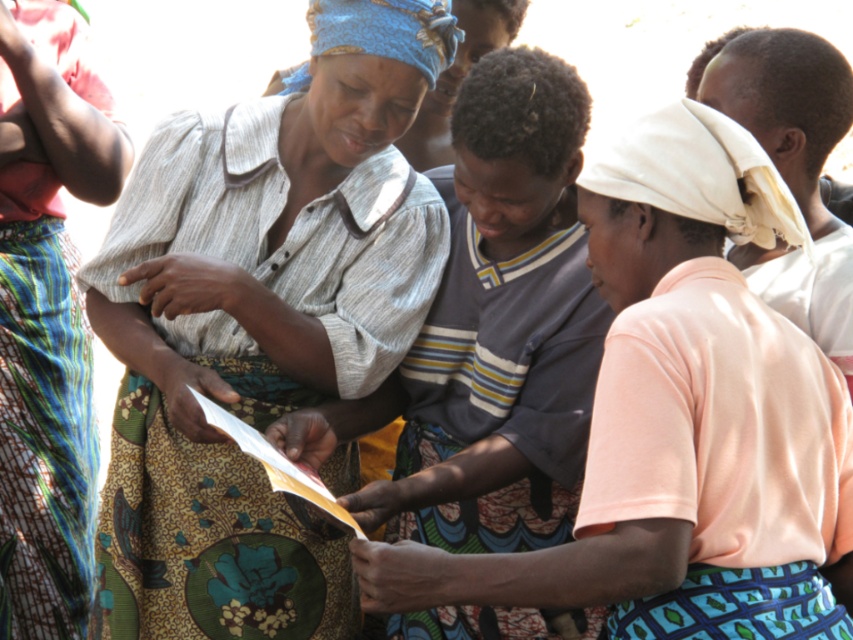
You are standing at the origin point of the image. Which of the two points, point [158,531] or point [25,307], is closer to you?

Point [158,531] is closer to you because it is in front of point [25,307].

Consider the image. You are standing in the scene and want to hand a document to the person wearing the matte gray shirt at center. Based on their position, where should you approach them from?

The matte gray shirt at center is located at point (x=259, y=323), so you should approach them from the front as they are facing forward in the scene.